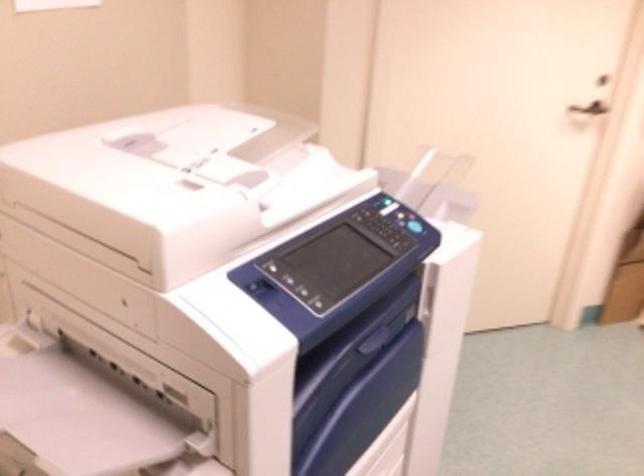
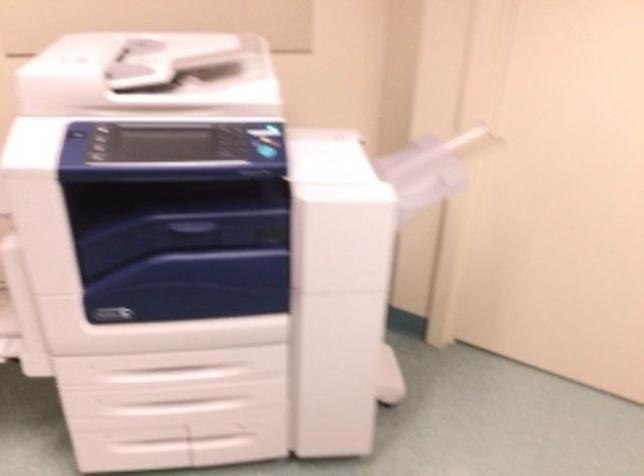
Locate, in the second image, the point that corresponds to (379,337) in the first image.

(196, 231)